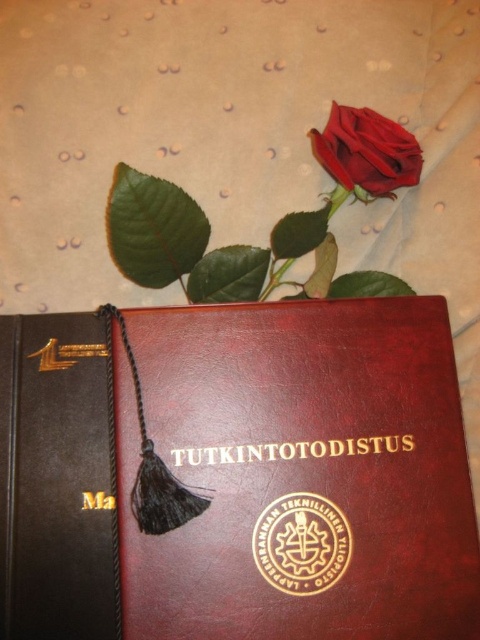
Question: Observing the image, what is the correct spatial positioning of brown leather book at center in reference to matte red rose at upper center?

Choices:
 (A) above
 (B) below

Answer: (B)

Question: Is brown leather book at center positioned before matte red rose at upper center?

Choices:
 (A) no
 (B) yes

Answer: (B)

Question: Is brown leather book at center below matte red rose at upper center?

Choices:
 (A) no
 (B) yes

Answer: (B)